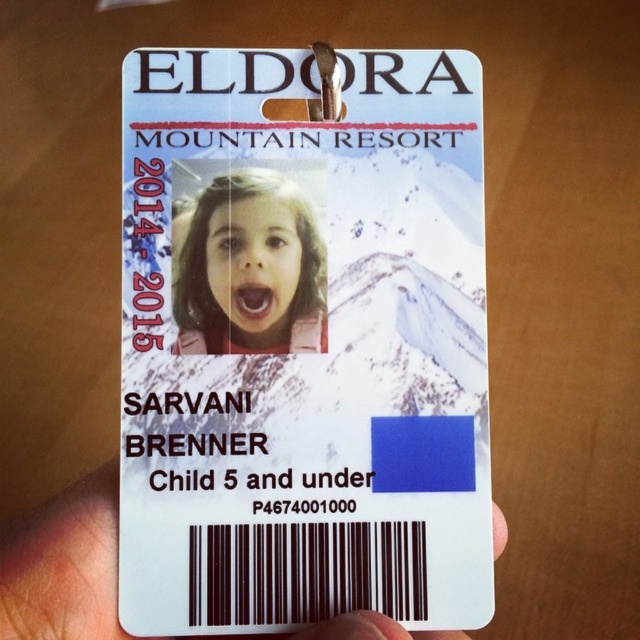
You are organizing a collection of old ID cards and come across this one. You need to determine if the matte plastic photo at center is positioned higher up than the white plastic hand at lower center. Can you confirm this?

The matte plastic photo at center is above the white plastic hand at lower center, so yes, it is positioned higher up.

You are holding the child identification card from Eldora Mountain Resort. The card has a point marked at coordinates (339, 474). If you want to place a sticker exactly 28.06 inches away from your eyes on this card, where should you place it?

The point marked at coordinates (339, 474) on the card is exactly 28.06 inches from the viewer, so placing the sticker there would be correct.